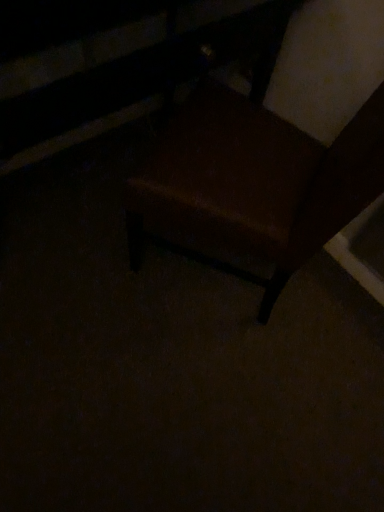
Measure the distance between brown leather chair at center and camera.

brown leather chair at center is 28.43 inches from camera.

The height and width of the screenshot is (512, 384). What do you see at coordinates (255, 182) in the screenshot?
I see `brown leather chair at center` at bounding box center [255, 182].

Where is `brown leather chair at center`? The height and width of the screenshot is (512, 384). brown leather chair at center is located at coordinates (255, 182).

This screenshot has height=512, width=384. Find the location of `brown leather chair at center`. brown leather chair at center is located at coordinates (255, 182).